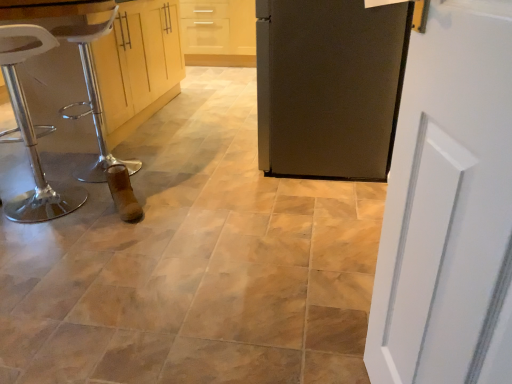
Where is `white painted wood door at right, which is the first door from bottom to top`? The width and height of the screenshot is (512, 384). white painted wood door at right, which is the first door from bottom to top is located at coordinates (449, 207).

What do you see at coordinates (93, 98) in the screenshot?
I see `white plastic bar stool at left` at bounding box center [93, 98].

What is the approximate width of white plastic bar stool at left?

white plastic bar stool at left is 14.79 inches wide.

Where is `white plastic stool at left`? This screenshot has height=384, width=512. white plastic stool at left is located at coordinates (34, 136).

What is the approximate width of white plastic stool at left?

The width of white plastic stool at left is 13.62 inches.

Where is `white painted wood door at right, positioned as the first door in left-to-right order`? Image resolution: width=512 pixels, height=384 pixels. white painted wood door at right, positioned as the first door in left-to-right order is located at coordinates (449, 207).

Are white plastic bar stool at left and white painted wood door at right, the second door viewed from the back, beside each other?

No, white plastic bar stool at left is not touching white painted wood door at right, the second door viewed from the back.

Which is in front, point (103, 146) or point (448, 171)?

Point (448, 171)

Based on the photo, considering the sizes of white plastic bar stool at left and white painted wood door at right, arranged as the 1th door when viewed from the front, in the image, is white plastic bar stool at left wider or thinner than white painted wood door at right, arranged as the 1th door when viewed from the front,?

Considering their sizes, white plastic bar stool at left looks broader than white painted wood door at right, arranged as the 1th door when viewed from the front.

Is white plastic bar stool at left at the left side of white painted wood door at right, which is the 2th door in right-to-left order?

Yes.

Considering the points (473, 166) and (15, 53), which point is in front, point (473, 166) or point (15, 53)?

The point (473, 166) is closer.

Looking at the image, does white painted wood door at right, arranged as the 1th door when viewed from the front, seem bigger or smaller compared to white plastic stool at left?

Clearly, white painted wood door at right, arranged as the 1th door when viewed from the front, is smaller in size than white plastic stool at left.

From the image's perspective, which object appears higher, white painted wood door at right, which is the first door from bottom to top, or white plastic stool at left?

white plastic stool at left appears higher in the image.

From a real-world perspective, is matte wood cabinetry at left positioned above or below white plastic stool at left?

From a real-world perspective, matte wood cabinetry at left is physically above white plastic stool at left.

Is matte wood cabinetry at left looking in the opposite direction of white plastic stool at left?

No, white plastic stool at left is not at the back of matte wood cabinetry at left.

Is matte wood cabinetry at left situated inside white plastic stool at left or outside?

matte wood cabinetry at left is spatially situated outside white plastic stool at left.

Where is `furniture below the matte wood cabinetry at left (from the image's perspective)`? Image resolution: width=512 pixels, height=384 pixels. furniture below the matte wood cabinetry at left (from the image's perspective) is located at coordinates (34, 136).

In terms of height, does matte black refrigerator at center, the 1th door positioned from the back, look taller or shorter compared to white painted wood door at right, which is the 2th door in right-to-left order?

In the image, matte black refrigerator at center, the 1th door positioned from the back, appears to be shorter than white painted wood door at right, which is the 2th door in right-to-left order.

Considering the points (259, 45) and (494, 158), which point is in front, point (259, 45) or point (494, 158)?

The point (494, 158) is in front.

Is matte black refrigerator at center, marked as the first door in a right-to-left arrangement, beside white painted wood door at right, positioned as the first door in left-to-right order?

No, matte black refrigerator at center, marked as the first door in a right-to-left arrangement, is not touching white painted wood door at right, positioned as the first door in left-to-right order.

Is white plastic stool at left oriented away from white plastic bar stool at left?

No.

Which object is wider, white plastic stool at left or white plastic bar stool at left?

white plastic bar stool at left.

Is white plastic bar stool at left located within white plastic stool at left?

Definitely not — white plastic bar stool at left is not inside white plastic stool at left.

Measure the distance from white plastic stool at left to white plastic bar stool at left.

white plastic stool at left is 14.34 inches from white plastic bar stool at left.

From a real-world perspective, is matte black refrigerator at center, marked as the first door in a right-to-left arrangement, beneath white plastic stool at left?

No, from a real-world perspective, matte black refrigerator at center, marked as the first door in a right-to-left arrangement, is not below white plastic stool at left.

Is the surface of matte black refrigerator at center, which ranks as the 2th door in bottom-to-top order, in direct contact with white plastic stool at left?

No, matte black refrigerator at center, which ranks as the 2th door in bottom-to-top order, is not next to white plastic stool at left.

Can we say matte black refrigerator at center, the second door viewed from the left, lies outside white plastic stool at left?

Absolutely, matte black refrigerator at center, the second door viewed from the left, is external to white plastic stool at left.

From the image's perspective, is matte black refrigerator at center, the second door viewed from the left, on white plastic stool at left?

Yes, from the image's perspective, matte black refrigerator at center, the second door viewed from the left, is above white plastic stool at left.

From the image's perspective, between matte black refrigerator at center, marked as the first door in a right-to-left arrangement, and white plastic bar stool at left, who is located below?

white plastic bar stool at left.

Is matte black refrigerator at center, which ranks as the 2th door in bottom-to-top order, facing away from white plastic bar stool at left?

matte black refrigerator at center, which ranks as the 2th door in bottom-to-top order, is not turned away from white plastic bar stool at left.

Starting from the white plastic bar stool at left, which door is the 1st one in front? Please provide its 2D coordinates.

[(329, 86)]

From a real-world perspective, is matte black refrigerator at center, the second door viewed from the left, physically above white plastic bar stool at left?

Yes, from a real-world perspective, matte black refrigerator at center, the second door viewed from the left, is on top of white plastic bar stool at left.

The height and width of the screenshot is (384, 512). Find the location of `bar stool that appears behind the white painted wood door at right, the second door from the top`. bar stool that appears behind the white painted wood door at right, the second door from the top is located at coordinates (93, 98).

Where is `door that appears in front of the white plastic stool at left`? door that appears in front of the white plastic stool at left is located at coordinates (449, 207).

Looking at the image, which one is located closer to white painted wood door at right, positioned as the first door in left-to-right order, white plastic stool at left or matte black refrigerator at center, marked as the first door in a right-to-left arrangement?

matte black refrigerator at center, marked as the first door in a right-to-left arrangement, is closer to white painted wood door at right, positioned as the first door in left-to-right order.

Looking at this image, when comparing their distances from matte black refrigerator at center, which ranks as the 2th door in bottom-to-top order, does matte wood cabinetry at left or white painted wood door at right, arranged as the 1th door when viewed from the front, seem closer?

The object closer to matte black refrigerator at center, which ranks as the 2th door in bottom-to-top order, is white painted wood door at right, arranged as the 1th door when viewed from the front.

Looking at the image, which one is located further to matte wood cabinetry at left, white plastic bar stool at left or matte black refrigerator at center, marked as the first door in a right-to-left arrangement?

matte black refrigerator at center, marked as the first door in a right-to-left arrangement, is positioned further to the anchor matte wood cabinetry at left.

Considering their positions, is white plastic stool at left positioned closer to matte black refrigerator at center, which ranks as the 2th door in bottom-to-top order, than white plastic bar stool at left?

white plastic bar stool at left is closer to matte black refrigerator at center, which ranks as the 2th door in bottom-to-top order.

Estimate the real-world distances between objects in this image. Which object is closer to white painted wood door at right, the second door from the top, white plastic stool at left or white plastic bar stool at left?

white plastic bar stool at left.

Based on their spatial positions, is white painted wood door at right, the second door viewed from the back, or matte black refrigerator at center, the second door viewed from the left, closer to matte wood cabinetry at left?

matte black refrigerator at center, the second door viewed from the left, is closer to matte wood cabinetry at left.

From the image, which object appears to be nearer to white painted wood door at right, which is the first door from bottom to top, matte black refrigerator at center, the second door viewed from the left, or white plastic stool at left?

Among the two, matte black refrigerator at center, the second door viewed from the left, is located nearer to white painted wood door at right, which is the first door from bottom to top.

When comparing their distances from white painted wood door at right, which is the first door from bottom to top, does white plastic bar stool at left or matte black refrigerator at center, the second door viewed from the left, seem further?

white plastic bar stool at left is positioned further to the anchor white painted wood door at right, which is the first door from bottom to top.

You are a GUI agent. You are given a task and a screenshot of the screen. Output one action in this format:
    pyautogui.click(x=<x>, y=<y>)
    Task: Click on the bar stool positioned between white painted wood door at right, positioned as the first door in left-to-right order, and matte wood cabinetry at left from near to far
    The image size is (512, 384).
    Given the screenshot: What is the action you would take?
    pyautogui.click(x=93, y=98)

Identify the location of bar stool situated between white plastic stool at left and matte black refrigerator at center, the 1th door from the top, from left to right. (93, 98).

Locate an element on the screen. door located between white painted wood door at right, which is the 2th door in right-to-left order, and matte wood cabinetry at left in the depth direction is located at coordinates (329, 86).

I want to click on furniture positioned between white painted wood door at right, which is the first door from bottom to top, and matte wood cabinetry at left from near to far, so click(34, 136).